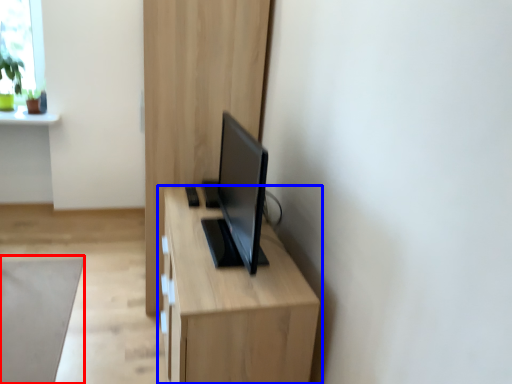
Question: Among these objects, which one is farthest to the camera, plain (highlighted by a red box) or table (highlighted by a blue box)?

Choices:
 (A) plain
 (B) table

Answer: (A)